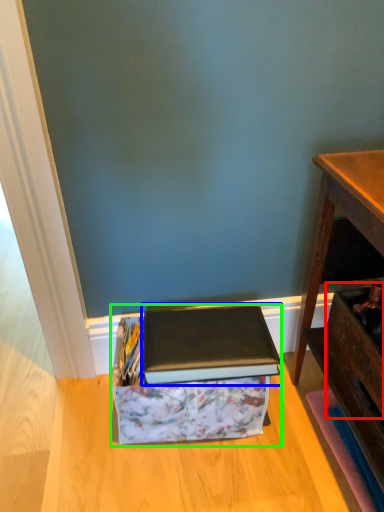
Question: Which object is the closest to the drawer (highlighted by a red box)? Choose among these: paperback book (highlighted by a blue box) or storage box (highlighted by a green box).

Choices:
 (A) paperback book
 (B) storage box

Answer: (A)